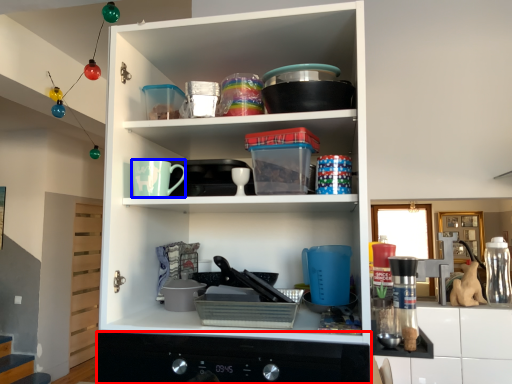
Question: Which object is further to the camera taking this photo, home appliance (highlighted by a red box) or mug (highlighted by a blue box)?

Choices:
 (A) home appliance
 (B) mug

Answer: (B)